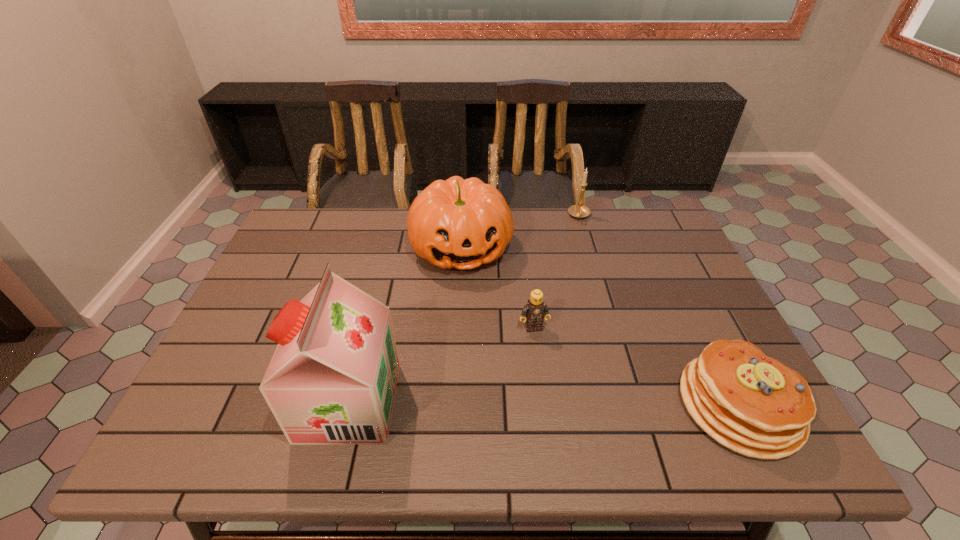
Identify the location of object that ranks as the fourth closest to the third shortest object. This screenshot has width=960, height=540. (332, 380).

Identify the location of vacant area that satisfies the following two spatial constraints: 1. on the front side of the third farthest object; 2. on the right side of the pumpkin. (457, 328).

You are a GUI agent. You are given a task and a screenshot of the screen. Output one action in this format:
    pyautogui.click(x=<x>, y=<y>)
    Task: Click on the vacant space that satisfies the following two spatial constraints: 1. on the front side of the third nearest object; 2. on the left side of the pumpkin
    The height and width of the screenshot is (540, 960).
    Given the screenshot: What is the action you would take?
    pyautogui.click(x=457, y=328)